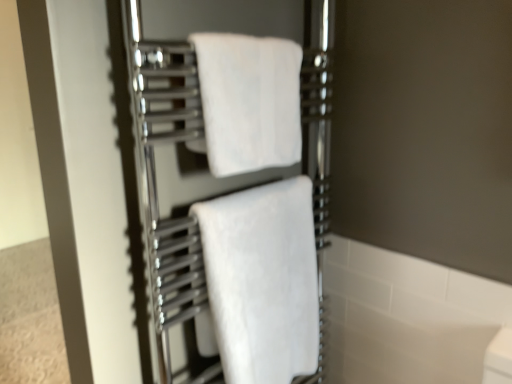
Question: Considering the relative sizes of white soft towel at center, positioned as the 1th towel in bottom-to-top order, and white soft towel at center, the second towel from the bottom, in the image provided, is white soft towel at center, positioned as the 1th towel in bottom-to-top order, shorter than white soft towel at center, the second towel from the bottom,?

Choices:
 (A) no
 (B) yes

Answer: (A)

Question: Is white soft towel at center, the first towel viewed from the top, at the back of white soft towel at center, positioned as the 1th towel in bottom-to-top order?

Choices:
 (A) yes
 (B) no

Answer: (B)

Question: Is white soft towel at center, positioned as the 1th towel in bottom-to-top order, not within white soft towel at center, the first towel viewed from the top?

Choices:
 (A) no
 (B) yes

Answer: (B)

Question: Would you say white soft towel at center, positioned as the 1th towel in bottom-to-top order, contains white soft towel at center, the first towel viewed from the top?

Choices:
 (A) yes
 (B) no

Answer: (B)

Question: Is white soft towel at center, which appears as the 2th towel when viewed from the top, facing towards white soft towel at center, the second towel from the bottom?

Choices:
 (A) no
 (B) yes

Answer: (A)

Question: Are white soft towel at center, positioned as the 1th towel in bottom-to-top order, and white soft towel at center, the first towel viewed from the top, beside each other?

Choices:
 (A) no
 (B) yes

Answer: (A)

Question: Considering the relative sizes of white soft towel at center, the second towel from the bottom, and white soft towel at center, positioned as the 1th towel in bottom-to-top order, in the image provided, is white soft towel at center, the second towel from the bottom, thinner than white soft towel at center, positioned as the 1th towel in bottom-to-top order,?

Choices:
 (A) no
 (B) yes

Answer: (B)

Question: From a real-world perspective, does white soft towel at center, the first towel viewed from the top, sit lower than white soft towel at center, positioned as the 1th towel in bottom-to-top order?

Choices:
 (A) no
 (B) yes

Answer: (A)

Question: Considering the relative sizes of white soft towel at center, the second towel from the bottom, and white soft towel at center, which appears as the 2th towel when viewed from the top, in the image provided, is white soft towel at center, the second towel from the bottom, taller than white soft towel at center, which appears as the 2th towel when viewed from the top,?

Choices:
 (A) yes
 (B) no

Answer: (B)

Question: Does white soft towel at center, the second towel from the bottom, have a smaller size compared to white soft towel at center, positioned as the 1th towel in bottom-to-top order?

Choices:
 (A) no
 (B) yes

Answer: (B)

Question: Considering the relative positions of white soft towel at center, the first towel viewed from the top, and white soft towel at center, positioned as the 1th towel in bottom-to-top order, in the image provided, is white soft towel at center, the first towel viewed from the top, to the right of white soft towel at center, positioned as the 1th towel in bottom-to-top order, from the viewer's perspective?

Choices:
 (A) no
 (B) yes

Answer: (A)

Question: Is white soft towel at center, the first towel viewed from the top, positioned before white soft towel at center, which appears as the 2th towel when viewed from the top?

Choices:
 (A) yes
 (B) no

Answer: (A)

Question: From their relative heights in the image, would you say white soft towel at center, positioned as the 1th towel in bottom-to-top order, is taller or shorter than white soft towel at center, the first towel viewed from the top?

Choices:
 (A) tall
 (B) short

Answer: (A)